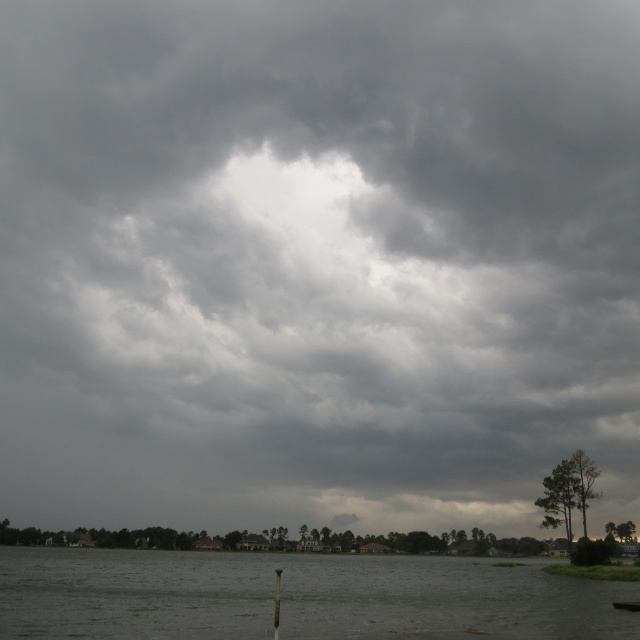
Does gray matte water at lower center appear over dark gray metallic boat at lower right?

No.

Image resolution: width=640 pixels, height=640 pixels. What do you see at coordinates (298, 596) in the screenshot?
I see `gray matte water at lower center` at bounding box center [298, 596].

Identify the location of gray matte water at lower center. Image resolution: width=640 pixels, height=640 pixels. (298, 596).